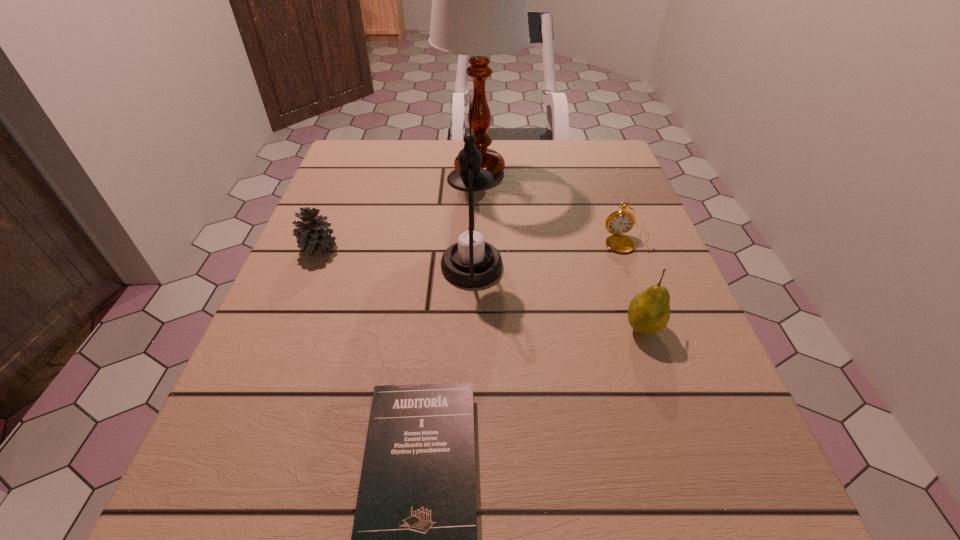
You are a GUI agent. You are given a task and a screenshot of the screen. Output one action in this format:
    pyautogui.click(x=<x>, y=<y>)
    Task: Click on the vacant space located on the face of the pocket watch
    This screenshot has width=960, height=540.
    Given the screenshot: What is the action you would take?
    pyautogui.click(x=701, y=434)

Identify the location of object that is at the far edge. (479, 9).

Identify the location of object at the left edge. This screenshot has width=960, height=540. (313, 236).

Where is `pear that is positioned at the right edge`? Image resolution: width=960 pixels, height=540 pixels. pear that is positioned at the right edge is located at coordinates (648, 313).

Locate an element on the screen. pocket watch located at the right edge is located at coordinates (619, 222).

What are the coordinates of `vacant space at the near edge of the desktop` in the screenshot? It's located at (648, 530).

This screenshot has width=960, height=540. What are the coordinates of `blank space at the left edge of the desktop` in the screenshot? It's located at (330, 204).

Locate an element on the screen. free spot at the right edge of the desktop is located at coordinates (708, 408).

Where is `vacant space at the far left corner of the desktop`? This screenshot has width=960, height=540. vacant space at the far left corner of the desktop is located at coordinates (342, 167).

Image resolution: width=960 pixels, height=540 pixels. What are the coordinates of `free space at the near left corner of the desktop` in the screenshot? It's located at (304, 512).